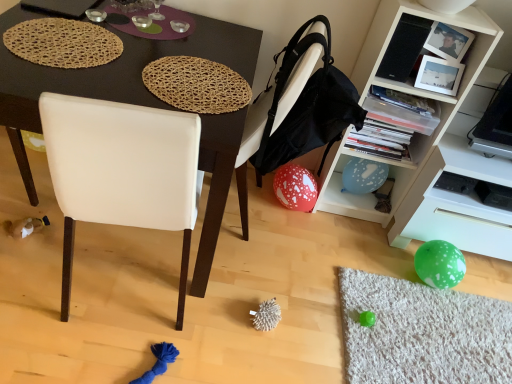
Where is `vacant area to the right of white leather chair at center`? This screenshot has width=512, height=384. vacant area to the right of white leather chair at center is located at coordinates (314, 264).